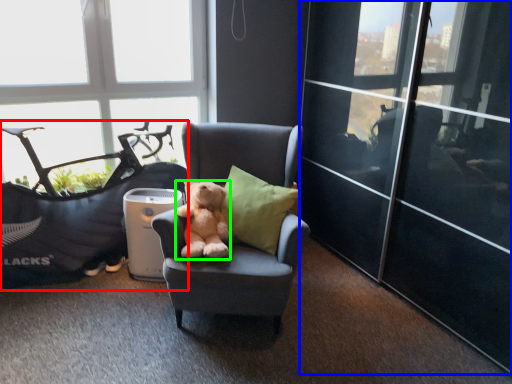
Question: Considering the real-world distances, which object is closest to bean bag chair (highlighted by a red box)? glass door (highlighted by a blue box) or teddy bear (highlighted by a green box).

Choices:
 (A) glass door
 (B) teddy bear

Answer: (B)